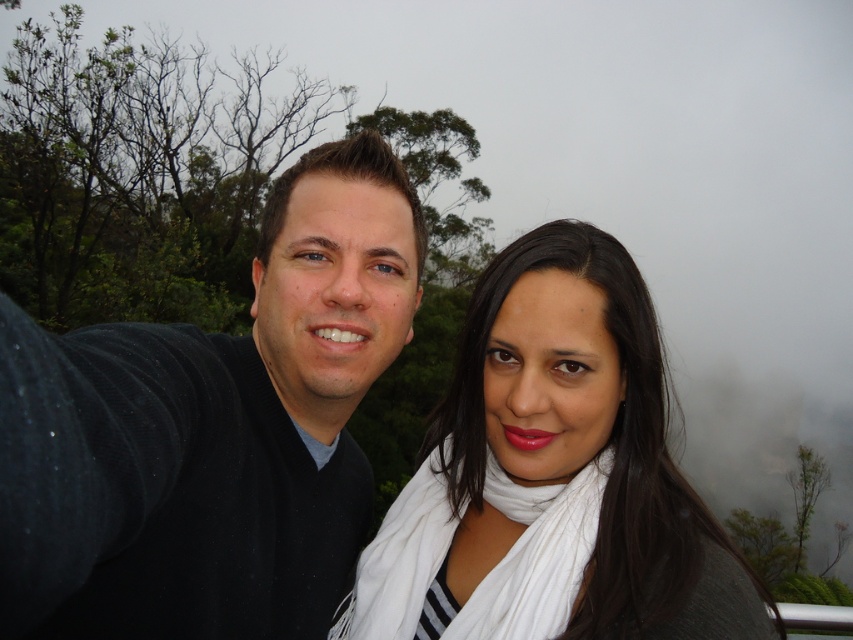
You are planning to mail a package that requires a packing material that can fit both the black sweater at center and the white scarf at right. If the sweater is larger, which item would need more space in the package?

The black sweater at center requires more space in the package because it has a larger size compared to the white scarf at right.

You are standing at the position of the person wearing the white scarf at right. You want to hand a small gift to the person on the left wearing the dark sweater. Can you reach them without moving your feet?

The distance between the two people is 1.17 meters. Since the average human arm span is about 1.5 meters, you can reach them without moving your feet.

You are taking a photo with two scarves visible. The white scarf at right and the white soft scarf at center. Which scarf is nearer to the camera?

The white scarf at right is closer to the viewer than the white soft scarf at center, so it is nearer to the camera.